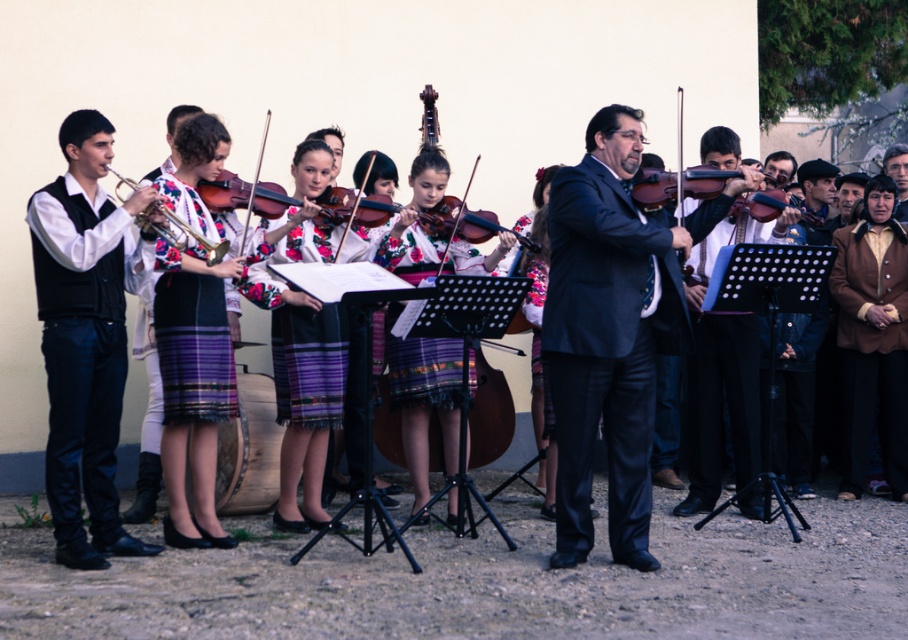
Between black denim pants at left and wooden violin at center, which one appears on the right side from the viewer's perspective?

wooden violin at center

Between point (70, 280) and point (338, 246), which one is positioned in front?

Point (70, 280) is more forward.

Is point (95, 348) closer to viewer compared to point (342, 237)?

Yes, it is in front of point (342, 237).

In order to click on black denim pants at left in this screenshot , I will do `click(86, 336)`.

Which is more to the right, wooden polished cello at center or wooden violin at center?

Positioned to the right is wooden polished cello at center.

Does wooden polished cello at center have a lesser height compared to wooden violin at center?

Yes, wooden polished cello at center is shorter than wooden violin at center.

Which is in front, point (391, 458) or point (392, 166)?

Positioned in front is point (391, 458).

Identify the location of wooden polished cello at center. (490, 417).

Looking at this image, between black denim pants at left and wooden polished cello at center, which one appears on the right side from the viewer's perspective?

Positioned to the right is wooden polished cello at center.

Is black denim pants at left above wooden polished cello at center?

Yes.

Between point (71, 516) and point (388, 417), which one is positioned in front?

Point (71, 516) is in front.

The height and width of the screenshot is (640, 908). I want to click on black denim pants at left, so click(86, 336).